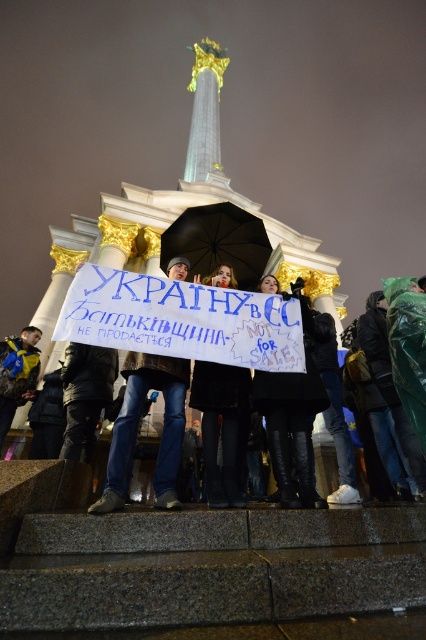
Question: Can you confirm if black fur coat at center is smaller than black leather pants at lower center?

Choices:
 (A) no
 (B) yes

Answer: (A)

Question: Does black leather pants at lower center have a lesser width compared to yellow leather jacket at lower left?

Choices:
 (A) yes
 (B) no

Answer: (A)

Question: Which object appears closest to the camera in this image?

Choices:
 (A) black leather pants at lower center
 (B) black matte umbrella at center

Answer: (A)

Question: Is black fur coat at center smaller than black leather pants at lower center?

Choices:
 (A) no
 (B) yes

Answer: (A)

Question: Which object is closer to the camera taking this photo?

Choices:
 (A) blue jeans at center
 (B) black matte umbrella at center
 (C) yellow leather jacket at lower left

Answer: (A)

Question: Which point is farther to the camera?

Choices:
 (A) black leather boots at lower center
 (B) yellow leather jacket at lower left
 (C) black matte umbrella at center

Answer: (C)